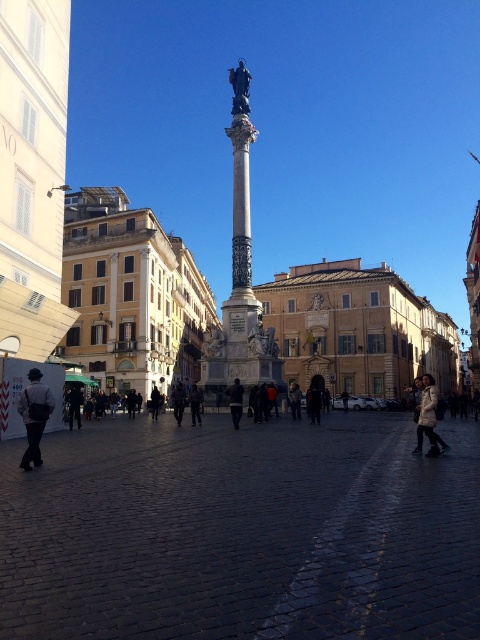
You are a tourist standing in the urban square and see both the dark blue fabric at center and dark blue jeans at center. Which object is positioned to the right from your perspective?

The dark blue fabric at center is to the right of the dark blue jeans at center.

You are standing in the urban square and want to take a photo of the monument. You notice two points of interest marked as point 1 at coordinates (432,422) and point 2 at coordinates (310,392). Which point is closer to you when you are facing the monument?

Point 1 at coordinates (432,422) is closer to the viewer than point 2 at coordinates (310,392).

You are a photographer setting up a tripod in the urban square. You notice the dark brown leather jacket at center and the black fabric person at center. Which object is wider from your viewpoint?

The dark brown leather jacket at center is wider than the black fabric person at center according to the description.